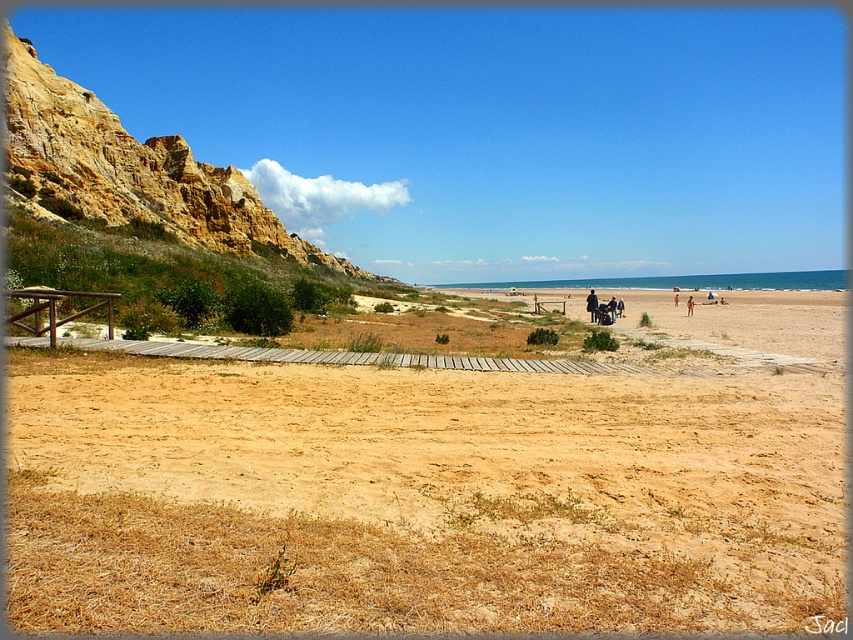
Question: Does brown sandy dirt field at center appear over rustic stone cliff at left?

Choices:
 (A) no
 (B) yes

Answer: (A)

Question: Does brown sandy dirt field at center lie in front of rustic stone cliff at left?

Choices:
 (A) yes
 (B) no

Answer: (A)

Question: Considering the relative positions of brown sandy dirt field at center and rustic stone cliff at left in the image provided, where is brown sandy dirt field at center located with respect to rustic stone cliff at left?

Choices:
 (A) above
 (B) below

Answer: (B)

Question: Which of the following is the closest to the observer?

Choices:
 (A) click(x=96, y=106)
 (B) click(x=317, y=417)

Answer: (B)

Question: Which of the following is the closest to the observer?

Choices:
 (A) (424, 426)
 (B) (83, 164)

Answer: (A)